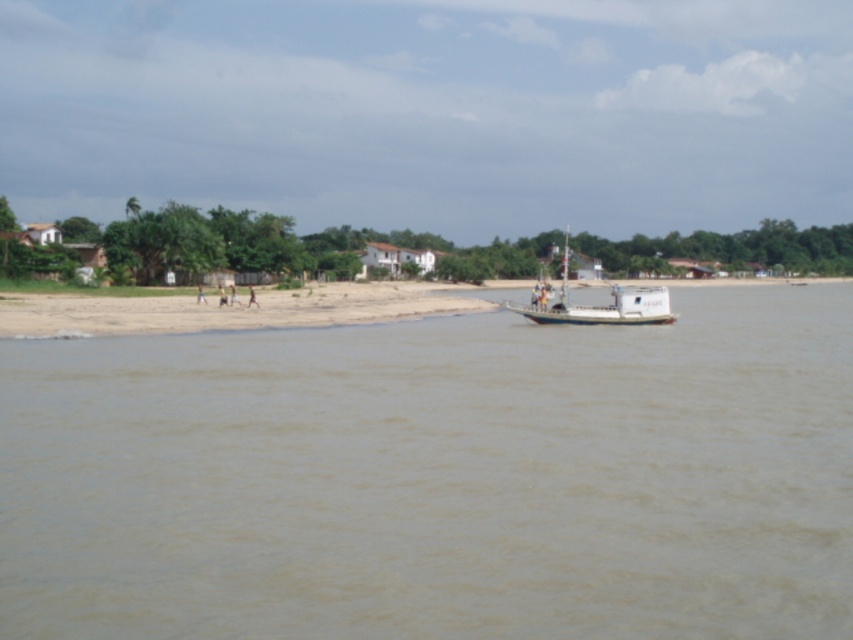
You are a photographer planning to capture the entire scene in one shot. Given that the brown muddy water at center and the white matte boat at center must both be visible, which object should you ensure is closer to the camera to avoid cropping?

Since the brown muddy water at center is smaller than the white matte boat at center, you should ensure the white matte boat at center is closer to the camera to avoid cropping both objects in the frame.

Looking at this image, you are a photographer standing on the sandy beach in the middle ground of the riverside scene. You want to capture a photo that includes both the brown muddy water at center and the white matte boat at center. Which object should you position closer to the left side of your camera frame?

The brown muddy water at center should be positioned closer to the left side of your camera frame because it is already located on the left side of the white matte boat at center according to the scene description.

You are a photographer standing on the riverside beach. You want to capture a photo of the white matte boat at center and the brown muddy water at center. Can you frame both objects in the same shot without moving your position?

Yes, you can frame both the white matte boat at center and the brown muddy water at center in the same shot because the brown muddy water at center is positioned under the white matte boat at center, meaning they are aligned vertically and within the same field of view.